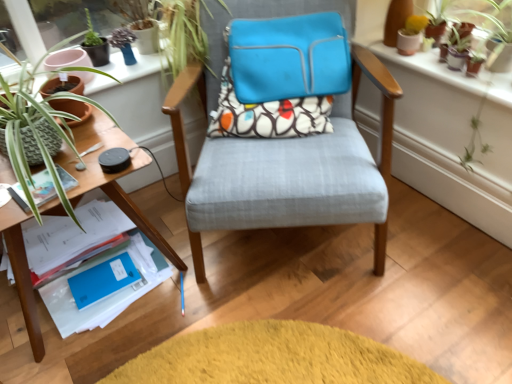
Locate an element on the screen. free spot in front of matte terracotta pot at left is located at coordinates (78, 139).